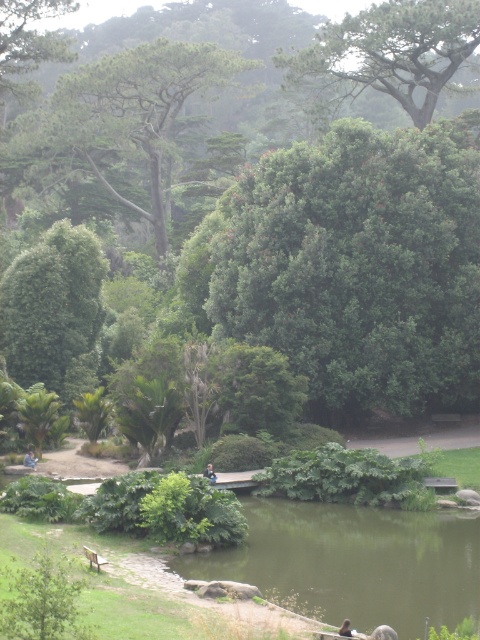
Between green textured tree at upper left and dark blue fabric jacket at center, which one has less height?

dark blue fabric jacket at center is shorter.

Between point (86, 83) and point (206, 468), which one is positioned behind?

The point (86, 83) is behind.

Locate an element on the screen. green textured tree at upper left is located at coordinates (121, 116).

Does green leafy tree at center have a greater height compared to green leafy tree at upper center?

In fact, green leafy tree at center may be shorter than green leafy tree at upper center.

Where is `green leafy tree at center`? The image size is (480, 640). green leafy tree at center is located at coordinates (360, 266).

Where is `green leafy tree at center`? green leafy tree at center is located at coordinates (360, 266).

Between green textured tree at upper left and green leafy tree at upper center, which one appears on the right side from the viewer's perspective?

From the viewer's perspective, green leafy tree at upper center appears more on the right side.

Does point (188, 67) lie in front of point (305, 51)?

No.

Where is `green textured tree at upper left`? green textured tree at upper left is located at coordinates (121, 116).